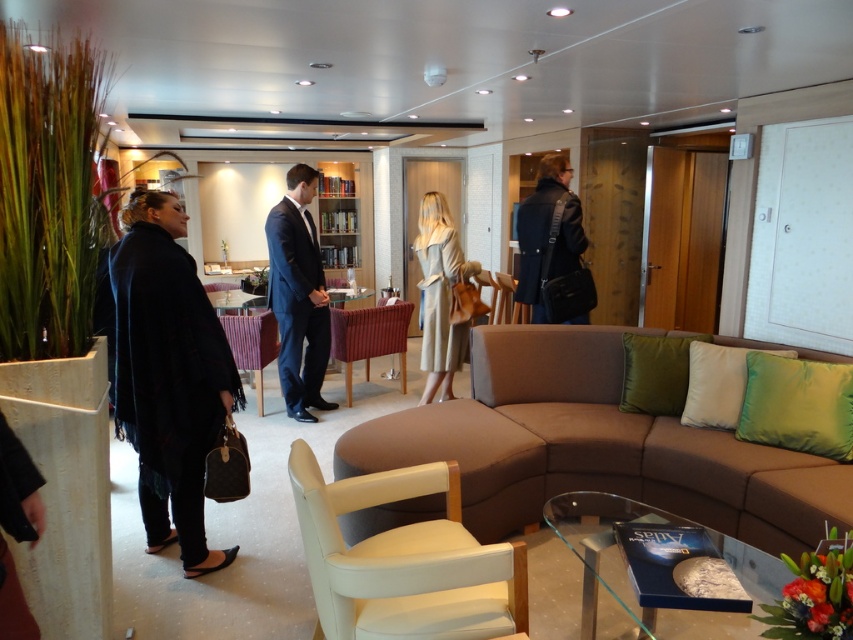
Question: Estimate the real-world distances between objects in this image. Which object is closer to the transparent glass table at center?

Choices:
 (A) light beige fabric coat at center
 (B) dark blue woolen shawl at left
 (C) white leather armchair at lower left

Answer: (C)

Question: Which object appears closest to the camera in this image?

Choices:
 (A) brown fabric couch at center
 (B) dark blue suit at center

Answer: (A)

Question: Is dark blue woolen shawl at left to the right of dark blue suit at center from the viewer's perspective?

Choices:
 (A) yes
 (B) no

Answer: (B)

Question: Is white leather armchair at lower left to the left of velvet burgundy armchair at center from the viewer's perspective?

Choices:
 (A) yes
 (B) no

Answer: (B)

Question: Based on their relative distances, which object is nearer to the light beige fabric coat at center?

Choices:
 (A) velvet burgundy armchair at center
 (B) dark blue woolen shawl at left

Answer: (A)

Question: Is the position of brown fabric couch at center less distant than that of light beige fabric coat at center?

Choices:
 (A) no
 (B) yes

Answer: (B)